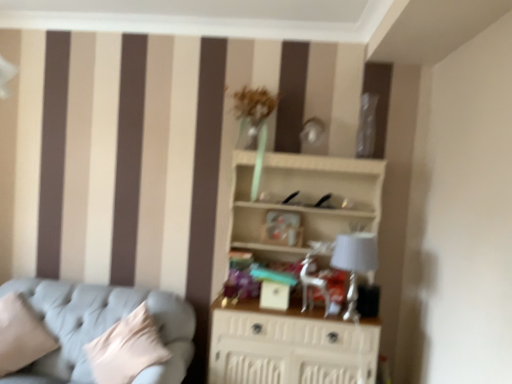
Question: Is the position of beige fabric pillow at lower left less distant than that of silver metallic swivel chair at center?

Choices:
 (A) no
 (B) yes

Answer: (B)

Question: Is silver metallic swivel chair at center at the back of beige fabric pillow at lower left?

Choices:
 (A) no
 (B) yes

Answer: (A)

Question: Are beige fabric pillow at lower left and silver metallic swivel chair at center located far from each other?

Choices:
 (A) yes
 (B) no

Answer: (A)

Question: From a real-world perspective, is beige fabric pillow at lower left located higher than silver metallic swivel chair at center?

Choices:
 (A) yes
 (B) no

Answer: (B)

Question: Is beige fabric pillow at lower left aimed at silver metallic swivel chair at center?

Choices:
 (A) yes
 (B) no

Answer: (B)

Question: From the image's perspective, relative to light blue fabric couch at lower left, is beige fabric pillow at lower left above or below?

Choices:
 (A) below
 (B) above

Answer: (B)

Question: Is beige fabric pillow at lower left bigger or smaller than light blue fabric couch at lower left?

Choices:
 (A) big
 (B) small

Answer: (B)

Question: In the image, is beige fabric pillow at lower left positioned in front of or behind light blue fabric couch at lower left?

Choices:
 (A) front
 (B) behind

Answer: (B)

Question: Which is correct: beige fabric pillow at lower left is inside light blue fabric couch at lower left, or outside of it?

Choices:
 (A) outside
 (B) inside

Answer: (A)

Question: Which is correct: white wood shelf at center is inside white fabric lampshade at right, or outside of it?

Choices:
 (A) outside
 (B) inside

Answer: (A)

Question: From the image's perspective, relative to white fabric lampshade at right, is white wood shelf at center above or below?

Choices:
 (A) above
 (B) below

Answer: (B)

Question: From a real-world perspective, is white wood shelf at center positioned above or below white fabric lampshade at right?

Choices:
 (A) above
 (B) below

Answer: (B)

Question: Considering their positions, is white wood shelf at center located in front of or behind white fabric lampshade at right?

Choices:
 (A) front
 (B) behind

Answer: (A)

Question: From a real-world perspective, is beige fabric pillow at lower left physically located above or below white wood shelf at center?

Choices:
 (A) above
 (B) below

Answer: (B)

Question: In terms of size, does beige fabric pillow at lower left appear bigger or smaller than white wood shelf at center?

Choices:
 (A) big
 (B) small

Answer: (B)